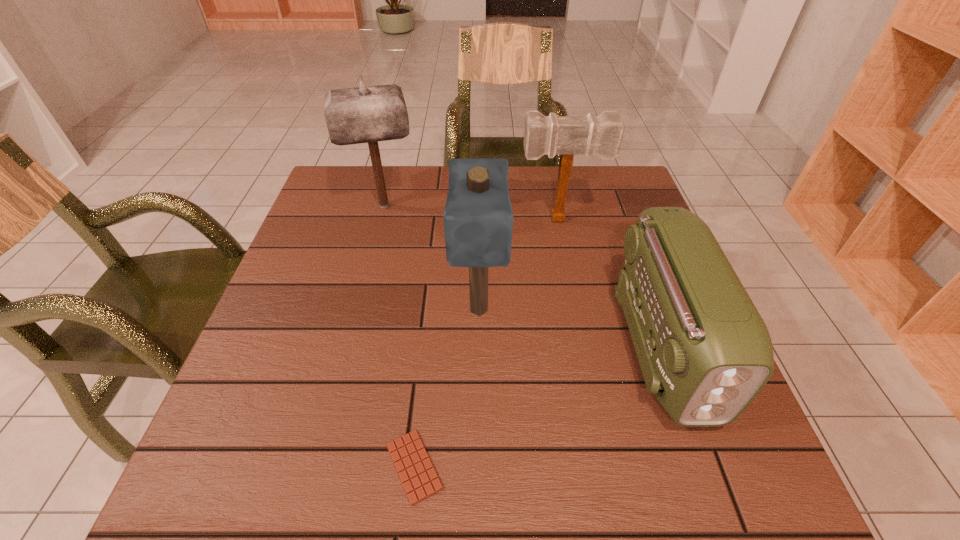
You are a GUI agent. You are given a task and a screenshot of the screen. Output one action in this format:
    pyautogui.click(x=<x>, y=<y>)
    Task: Click on the free space at the right edge of the desktop
    
    Given the screenshot: What is the action you would take?
    pyautogui.click(x=633, y=214)

This screenshot has height=540, width=960. I want to click on vacant space at the far right corner of the desktop, so click(590, 192).

Locate an element on the screen. The height and width of the screenshot is (540, 960). free space between the leftmost object and the shortest object is located at coordinates (399, 336).

The image size is (960, 540). In order to click on free space between the nearest mallet and the shortest mallet in this screenshot , I will do `click(519, 265)`.

In order to click on vacant area that lies between the nearest mallet and the candy bar in this screenshot , I will do `click(446, 388)`.

At what (x,y) coordinates should I click in order to perform the action: click on unoccupied position between the leftmost mallet and the second shortest object. Please return your answer as a coordinate pair (x, y). The image size is (960, 540). Looking at the image, I should click on (523, 276).

Identify the location of vacant region between the shortest object and the rightmost mallet. (487, 343).

You are a GUI agent. You are given a task and a screenshot of the screen. Output one action in this format:
    pyautogui.click(x=<x>, y=<y>)
    Task: Click on the vacant region between the shortest object and the leftmost object
    The height and width of the screenshot is (540, 960).
    Given the screenshot: What is the action you would take?
    pyautogui.click(x=399, y=336)

The height and width of the screenshot is (540, 960). I want to click on vacant area that lies between the second mallet from left to right and the shortest mallet, so click(x=519, y=265).

This screenshot has width=960, height=540. Identify the location of vacant space that is in between the radio_receiver and the second mallet from right to left. (570, 328).